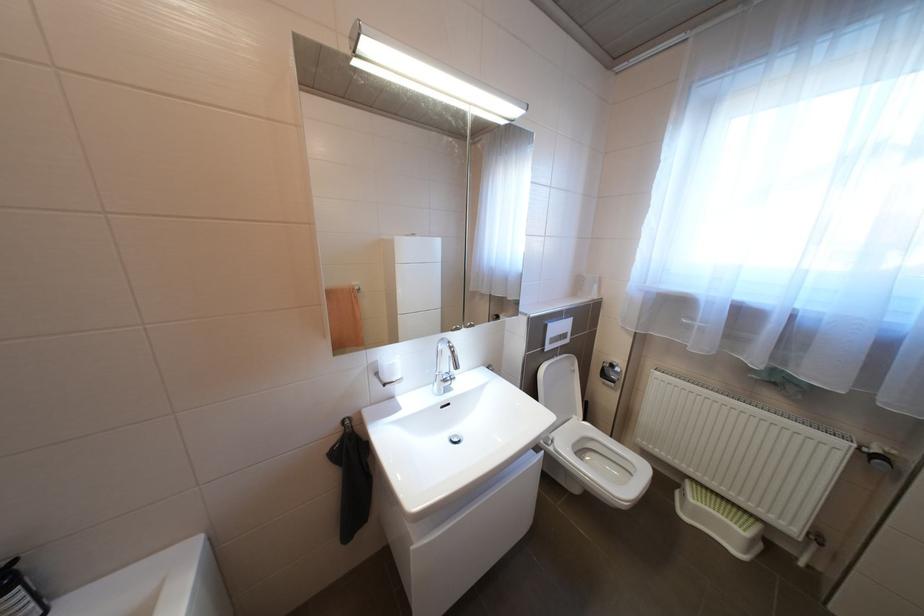
Image resolution: width=924 pixels, height=616 pixels. Identify the location of white step stool. (719, 519).